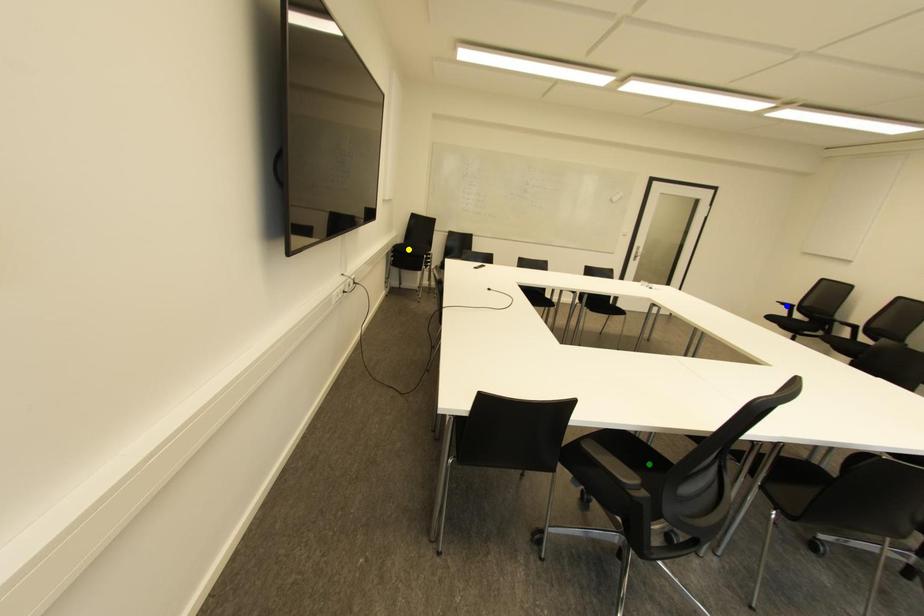
Order these from nearest to farthest:
green point, yellow point, blue point

1. green point
2. yellow point
3. blue point